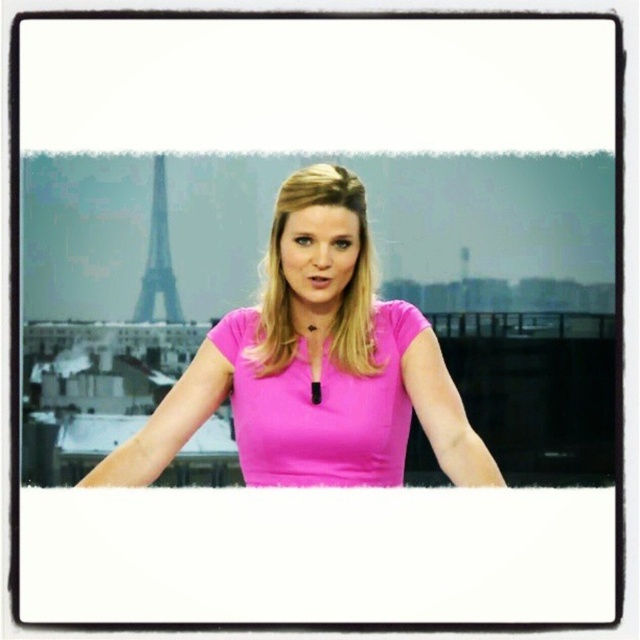
You are a photographer adjusting the camera focus. The subject is at point (400, 316) and the background detail you want to avoid is at point (152, 195). Which point should you focus on to ensure the subject is sharp while keeping the unwanted detail out of focus?

You should focus on point (400, 316) because it is in front of point (152, 195), ensuring the subject is sharp while the background detail remains out of focus.

You are a fashion designer reviewing a photo shoot. In the image, you see a person wearing a pink matte dress at center and a matte pink dress at center. Which dress is placed on top?

The pink matte dress at center is positioned over the matte pink dress at center, so the pink matte dress at center is on top.

You are an interior designer working on a virtual reality project. You need to place a virtual Eiffel Tower replica exactly at the coordinates where the matte pink dress at center is located in the image. What are the coordinates where you should place the Eiffel Tower replica?

The coordinates for the matte pink dress at center are at point (321, 408), so you should place the Eiffel Tower replica at those coordinates.